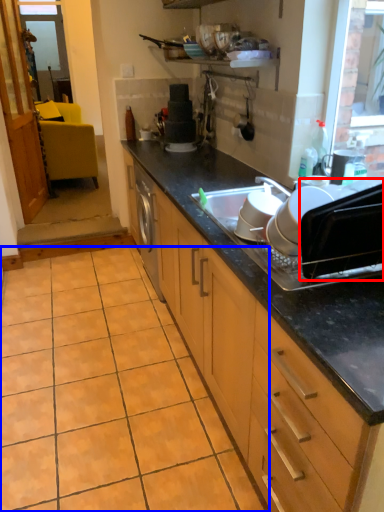
Question: Among these objects, which one is farthest to the camera, appliance (highlighted by a red box) or ceramic tile (highlighted by a blue box)?

Choices:
 (A) appliance
 (B) ceramic tile

Answer: (B)